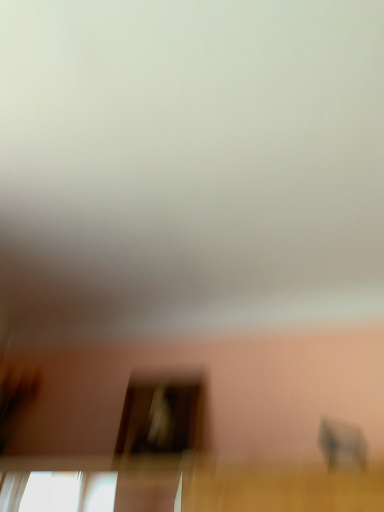
Question: Considering the positions of gray matte baby elephant at lower right and transparent glass screen door at center in the image, is gray matte baby elephant at lower right wider or thinner than transparent glass screen door at center?

Choices:
 (A) thin
 (B) wide

Answer: (A)

Question: From the image's perspective, is gray matte baby elephant at lower right above or below transparent glass screen door at center?

Choices:
 (A) below
 (B) above

Answer: (B)

Question: Considering the positions of point (350, 443) and point (175, 441), is point (350, 443) closer or farther from the camera than point (175, 441)?

Choices:
 (A) farther
 (B) closer

Answer: (B)

Question: From the image's perspective, relative to gray matte baby elephant at lower right, is transparent glass screen door at center above or below?

Choices:
 (A) above
 (B) below

Answer: (B)

Question: Looking at their shapes, would you say transparent glass screen door at center is wider or thinner than gray matte baby elephant at lower right?

Choices:
 (A) wide
 (B) thin

Answer: (A)

Question: In terms of height, does transparent glass screen door at center look taller or shorter compared to gray matte baby elephant at lower right?

Choices:
 (A) short
 (B) tall

Answer: (B)

Question: Is transparent glass screen door at center bigger or smaller than gray matte baby elephant at lower right?

Choices:
 (A) small
 (B) big

Answer: (B)